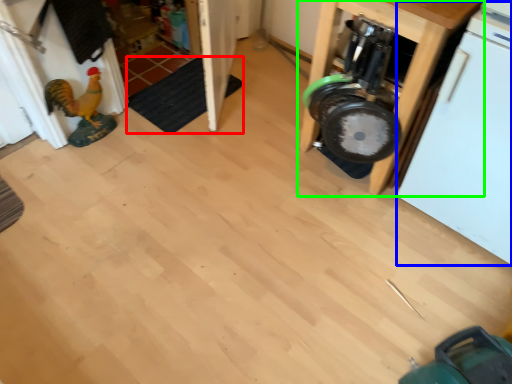
Question: Which is farther away from mat (highlighted by a red box)? dish washer (highlighted by a blue box) or furniture (highlighted by a green box)?

Choices:
 (A) dish washer
 (B) furniture

Answer: (A)